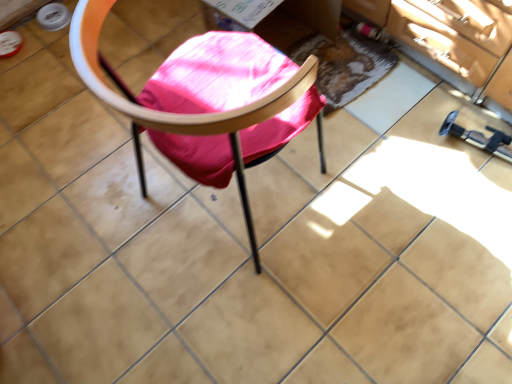
What are the coordinates of `vacant position to the left of wooden chair at center` in the screenshot? It's located at pyautogui.click(x=100, y=214).